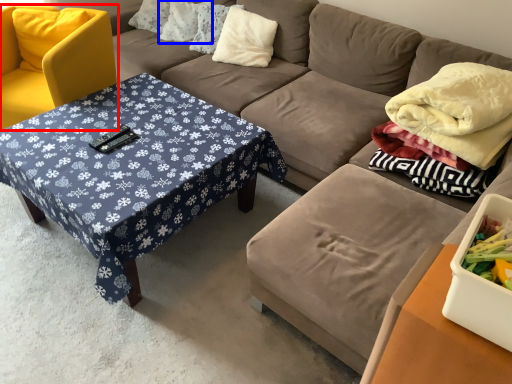
Question: Which of the following is the farthest to the observer, chair (highlighted by a red box) or pillow (highlighted by a blue box)?

Choices:
 (A) chair
 (B) pillow

Answer: (B)